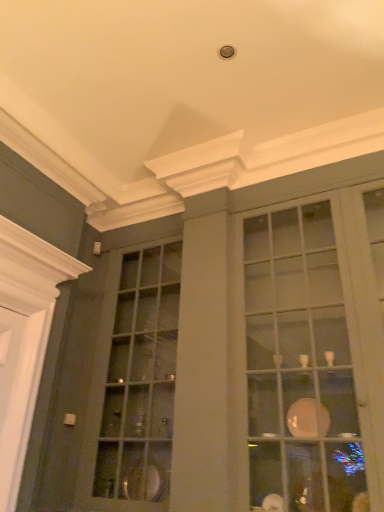
Where is `matte glass window at left`? matte glass window at left is located at coordinates (133, 384).

The height and width of the screenshot is (512, 384). What do you see at coordinates (133, 384) in the screenshot?
I see `matte glass window at left` at bounding box center [133, 384].

You are a GUI agent. You are given a task and a screenshot of the screen. Output one action in this format:
    pyautogui.click(x=<x>, y=<y>)
    Task: Click on the matte glass window at left
    This screenshot has height=512, width=384.
    Given the screenshot: What is the action you would take?
    pyautogui.click(x=133, y=384)